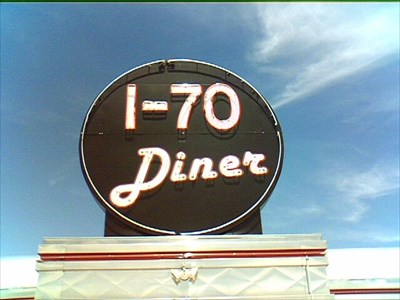
In order to click on brown moulding in this screenshot , I will do `click(40, 257)`, `click(324, 253)`.